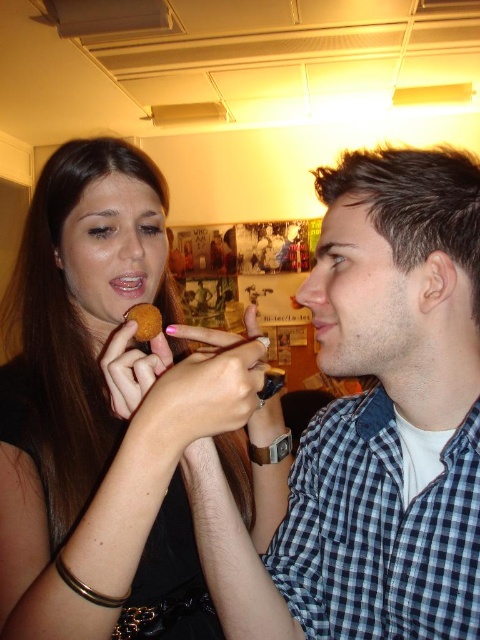
You are a photographer trying to capture a candid shot of the two people in the scene. You want to ensure that both the checkered fabric shirt at center and the pink matte lipstick at mouth right are clearly visible in the photo. Given their relative heights, which object should you focus on first to ensure both are in focus?

The checkered fabric shirt at center is much taller than the pink matte lipstick at mouth right. To ensure both are in focus, you should focus on the checkered fabric shirt at center first since it is taller and likely further away, allowing the depth of field to cover the closer pink matte lipstick at mouth right.

What is the 2D coordinate of the checkered fabric shirt at center?

The checkered fabric shirt at center is located at the 2D coordinate point of (372, 422).